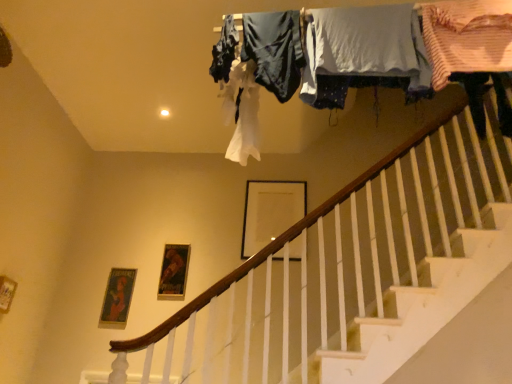
Consider the image. Measure the distance between striped cotton shirt at upper right, which is the 1th clothing in right-to-left order, and camera.

striped cotton shirt at upper right, which is the 1th clothing in right-to-left order, and camera are 5.51 feet apart.

You are a GUI agent. You are given a task and a screenshot of the screen. Output one action in this format:
    pyautogui.click(x=<x>, y=<y>)
    Task: Click on the dark blue fabric at upper center, the 4th clothing viewed from the right
    
    Given the screenshot: What is the action you would take?
    pyautogui.click(x=224, y=51)

The width and height of the screenshot is (512, 384). Describe the element at coordinates (224, 51) in the screenshot. I see `dark blue fabric at upper center, the first clothing in the left-to-right sequence` at that location.

You are a GUI agent. You are given a task and a screenshot of the screen. Output one action in this format:
    pyautogui.click(x=<x>, y=<y>)
    Task: Click on the white cotton shirt at upper center, which appears as the third clothing when viewed from the left
    The width and height of the screenshot is (512, 384).
    Given the screenshot: What is the action you would take?
    pyautogui.click(x=364, y=53)

Locate an element on the screen. The height and width of the screenshot is (384, 512). matte white picture frame at center, positioned as the second picture frame in bottom-to-top order is located at coordinates (270, 212).

The height and width of the screenshot is (384, 512). What do you see at coordinates (270, 212) in the screenshot?
I see `matte white picture frame at center, positioned as the 1th picture frame in top-to-bottom order` at bounding box center [270, 212].

The image size is (512, 384). I want to click on metallic gold picture frame at center, placed as the 2th picture frame when sorted from right to left, so click(x=174, y=272).

Is the depth of white cotton shirt at upper center, the 2th clothing viewed from the right, greater than that of metallic gold picture frame at center, the first picture frame in the left-to-right sequence?

No.

Which object is thinner, white cotton shirt at upper center, the 2th clothing viewed from the right, or metallic gold picture frame at center, the 2th picture frame positioned from the top?

Thinner between the two is metallic gold picture frame at center, the 2th picture frame positioned from the top.

Could you measure the distance between white cotton shirt at upper center, the 2th clothing viewed from the right, and metallic gold picture frame at center, placed as the 2th picture frame when sorted from right to left?

white cotton shirt at upper center, the 2th clothing viewed from the right, and metallic gold picture frame at center, placed as the 2th picture frame when sorted from right to left, are 2.17 meters apart.

Where is `the 2nd clothing above when counting from the metallic gold picture frame at center, which is counted as the first picture frame, starting from the bottom (from the image's perspective)`? This screenshot has width=512, height=384. the 2nd clothing above when counting from the metallic gold picture frame at center, which is counted as the first picture frame, starting from the bottom (from the image's perspective) is located at coordinates (364, 53).

From the picture: Is silky blue fabric at upper center, arranged as the third clothing when viewed from the right, looking in the opposite direction of dark blue fabric at upper center, the 4th clothing viewed from the right?

No, silky blue fabric at upper center, arranged as the third clothing when viewed from the right,'s orientation is not away from dark blue fabric at upper center, the 4th clothing viewed from the right.

Which object is more forward, silky blue fabric at upper center, the second clothing in the left-to-right sequence, or dark blue fabric at upper center, the first clothing in the left-to-right sequence?

silky blue fabric at upper center, the second clothing in the left-to-right sequence, is more forward.

Considering the sizes of objects silky blue fabric at upper center, the second clothing in the left-to-right sequence, and dark blue fabric at upper center, the 4th clothing viewed from the right, in the image provided, who is shorter, silky blue fabric at upper center, the second clothing in the left-to-right sequence, or dark blue fabric at upper center, the 4th clothing viewed from the right,?

Standing shorter between the two is dark blue fabric at upper center, the 4th clothing viewed from the right.

Between point (253, 42) and point (230, 46), which one is positioned in front?

The point (253, 42) is more forward.

Considering the relative positions of striped cotton shirt at upper right, which is the 4th clothing from left to right, and white cotton shirt at upper center, which appears as the third clothing when viewed from the left, in the image provided, is striped cotton shirt at upper right, which is the 4th clothing from left to right, to the left or to the right of white cotton shirt at upper center, which appears as the third clothing when viewed from the left,?

From the image, it's evident that striped cotton shirt at upper right, which is the 4th clothing from left to right, is to the right of white cotton shirt at upper center, which appears as the third clothing when viewed from the left.

Is striped cotton shirt at upper right, which is the 4th clothing from left to right, far away from white cotton shirt at upper center, which appears as the third clothing when viewed from the left?

No, striped cotton shirt at upper right, which is the 4th clothing from left to right, is not far from white cotton shirt at upper center, which appears as the third clothing when viewed from the left.

Is striped cotton shirt at upper right, which is the 1th clothing in right-to-left order, oriented away from white cotton shirt at upper center, which appears as the third clothing when viewed from the left?

No, striped cotton shirt at upper right, which is the 1th clothing in right-to-left order, is not facing the opposite direction of white cotton shirt at upper center, which appears as the third clothing when viewed from the left.

The width and height of the screenshot is (512, 384). I want to click on the 1st clothing counting from the left of the striped cotton shirt at upper right, which is the 4th clothing from left to right, so [364, 53].

Considering the positions of objects matte white picture frame at center, the first picture frame positioned from the right, and white cotton shirt at upper center, which appears as the third clothing when viewed from the left, in the image provided, who is more to the left, matte white picture frame at center, the first picture frame positioned from the right, or white cotton shirt at upper center, which appears as the third clothing when viewed from the left,?

From the viewer's perspective, matte white picture frame at center, the first picture frame positioned from the right, appears more on the left side.

What's the angular difference between matte white picture frame at center, positioned as the second picture frame in bottom-to-top order, and white cotton shirt at upper center, the 2th clothing viewed from the right,'s facing directions?

There is a 0.534-degree angle between the facing directions of matte white picture frame at center, positioned as the second picture frame in bottom-to-top order, and white cotton shirt at upper center, the 2th clothing viewed from the right.

From the image's perspective, is matte white picture frame at center, positioned as the 1th picture frame in top-to-bottom order, positioned above or below white cotton shirt at upper center, which appears as the third clothing when viewed from the left?

matte white picture frame at center, positioned as the 1th picture frame in top-to-bottom order, is below white cotton shirt at upper center, which appears as the third clothing when viewed from the left.

From their relative heights in the image, would you say matte white picture frame at center, positioned as the 1th picture frame in top-to-bottom order, is taller or shorter than white cotton shirt at upper center, the 2th clothing viewed from the right?

In the image, matte white picture frame at center, positioned as the 1th picture frame in top-to-bottom order, appears to be taller than white cotton shirt at upper center, the 2th clothing viewed from the right.

Considering the points (429, 51) and (251, 222), which point is in front, point (429, 51) or point (251, 222)?

The point (429, 51) is closer to the camera.

Which of these two, striped cotton shirt at upper right, which is the 1th clothing in right-to-left order, or matte white picture frame at center, positioned as the second picture frame in bottom-to-top order, stands taller?

matte white picture frame at center, positioned as the second picture frame in bottom-to-top order.

At what (x,y) coordinates should I click in order to perform the action: click on clothing that is the 3rd object located above the matte white picture frame at center, positioned as the 1th picture frame in top-to-bottom order (from the image's perspective). Please return your answer as a coordinate pair (x, y). This screenshot has height=384, width=512. Looking at the image, I should click on (467, 37).

Would you consider striped cotton shirt at upper right, which is the 1th clothing in right-to-left order, to be distant from matte white picture frame at center, positioned as the second picture frame in bottom-to-top order?

Yes.

Considering the positions of objects silky blue fabric at upper center, arranged as the third clothing when viewed from the right, and metallic gold picture frame at center, the 2th picture frame positioned from the top, in the image provided, who is more to the left, silky blue fabric at upper center, arranged as the third clothing when viewed from the right, or metallic gold picture frame at center, the 2th picture frame positioned from the top,?

Positioned to the left is metallic gold picture frame at center, the 2th picture frame positioned from the top.

Can you confirm if silky blue fabric at upper center, the second clothing in the left-to-right sequence, is taller than metallic gold picture frame at center, the 2th picture frame positioned from the top?

Indeed, silky blue fabric at upper center, the second clothing in the left-to-right sequence, has a greater height compared to metallic gold picture frame at center, the 2th picture frame positioned from the top.

Considering the relative sizes of silky blue fabric at upper center, arranged as the third clothing when viewed from the right, and metallic gold picture frame at center, which is counted as the first picture frame, starting from the bottom, in the image provided, is silky blue fabric at upper center, arranged as the third clothing when viewed from the right, smaller than metallic gold picture frame at center, which is counted as the first picture frame, starting from the bottom,?

Actually, silky blue fabric at upper center, arranged as the third clothing when viewed from the right, might be larger than metallic gold picture frame at center, which is counted as the first picture frame, starting from the bottom.

From a real-world perspective, relative to metallic gold picture frame at center, placed as the 2th picture frame when sorted from right to left, is silky blue fabric at upper center, the second clothing in the left-to-right sequence, vertically above or below?

silky blue fabric at upper center, the second clothing in the left-to-right sequence, is above metallic gold picture frame at center, placed as the 2th picture frame when sorted from right to left.

Which is in front, point (226, 36) or point (433, 62)?

Positioned in front is point (433, 62).

Identify the location of clothing that is the 3rd object to the left of the striped cotton shirt at upper right, which is the 4th clothing from left to right, starting at the anchor. (224, 51).

Which of these two, dark blue fabric at upper center, the first clothing in the left-to-right sequence, or striped cotton shirt at upper right, which is the 1th clothing in right-to-left order, stands taller?

striped cotton shirt at upper right, which is the 1th clothing in right-to-left order, is taller.

From the image's perspective, which one is positioned lower, dark blue fabric at upper center, the 4th clothing viewed from the right, or striped cotton shirt at upper right, which is the 1th clothing in right-to-left order?

striped cotton shirt at upper right, which is the 1th clothing in right-to-left order.

Locate an element on the screen. This screenshot has height=384, width=512. the 2nd clothing located above the metallic gold picture frame at center, the 2th picture frame positioned from the top (from a real-world perspective) is located at coordinates (364, 53).

From a real-world perspective, starting from the dark blue fabric at upper center, the first clothing in the left-to-right sequence, which clothing is the 2nd one below it? Please provide its 2D coordinates.

[(274, 50)]

When comparing their distances from white cotton shirt at upper center, the 2th clothing viewed from the right, does silky blue fabric at upper center, arranged as the third clothing when viewed from the right, or metallic gold picture frame at center, which is counted as the first picture frame, starting from the bottom, seem further?

The object further to white cotton shirt at upper center, the 2th clothing viewed from the right, is metallic gold picture frame at center, which is counted as the first picture frame, starting from the bottom.

When comparing their distances from white cotton shirt at upper center, which appears as the third clothing when viewed from the left, does metallic gold picture frame at center, the first picture frame in the left-to-right sequence, or matte white picture frame at center, positioned as the second picture frame in bottom-to-top order, seem further?

Based on the image, metallic gold picture frame at center, the first picture frame in the left-to-right sequence, appears to be further to white cotton shirt at upper center, which appears as the third clothing when viewed from the left.

Estimate the real-world distances between objects in this image. Which object is closer to white cotton shirt at upper center, the 2th clothing viewed from the right, metallic gold picture frame at center, placed as the 2th picture frame when sorted from right to left, or dark blue fabric at upper center, the first clothing in the left-to-right sequence?

Based on the image, dark blue fabric at upper center, the first clothing in the left-to-right sequence, appears to be nearer to white cotton shirt at upper center, the 2th clothing viewed from the right.

From the image, which object appears to be nearer to metallic gold picture frame at center, the 2th picture frame positioned from the top, white cotton shirt at upper center, which appears as the third clothing when viewed from the left, or dark blue fabric at upper center, the 4th clothing viewed from the right?

Among the two, dark blue fabric at upper center, the 4th clothing viewed from the right, is located nearer to metallic gold picture frame at center, the 2th picture frame positioned from the top.

Which object lies nearer to the anchor point dark blue fabric at upper center, the first clothing in the left-to-right sequence, metallic gold picture frame at center, the first picture frame in the left-to-right sequence, or matte white picture frame at center, positioned as the second picture frame in bottom-to-top order?

matte white picture frame at center, positioned as the second picture frame in bottom-to-top order, is positioned closer to the anchor dark blue fabric at upper center, the first clothing in the left-to-right sequence.

In the scene shown: When comparing their distances from matte white picture frame at center, positioned as the 1th picture frame in top-to-bottom order, does silky blue fabric at upper center, the second clothing in the left-to-right sequence, or dark blue fabric at upper center, the first clothing in the left-to-right sequence, seem further?

Among the two, dark blue fabric at upper center, the first clothing in the left-to-right sequence, is located further to matte white picture frame at center, positioned as the 1th picture frame in top-to-bottom order.

Looking at the image, which one is located closer to matte white picture frame at center, positioned as the second picture frame in bottom-to-top order, white cotton shirt at upper center, the 2th clothing viewed from the right, or metallic gold picture frame at center, the 2th picture frame positioned from the top?

The object closer to matte white picture frame at center, positioned as the second picture frame in bottom-to-top order, is metallic gold picture frame at center, the 2th picture frame positioned from the top.

Estimate the real-world distances between objects in this image. Which object is further from silky blue fabric at upper center, arranged as the third clothing when viewed from the right, metallic gold picture frame at center, the first picture frame in the left-to-right sequence, or dark blue fabric at upper center, the first clothing in the left-to-right sequence?

metallic gold picture frame at center, the first picture frame in the left-to-right sequence, is further to silky blue fabric at upper center, arranged as the third clothing when viewed from the right.

The image size is (512, 384). In order to click on picture frame between striped cotton shirt at upper right, which is the 1th clothing in right-to-left order, and matte white picture frame at center, positioned as the 1th picture frame in top-to-bottom order, in the front-back direction in this screenshot , I will do `click(174, 272)`.

Find the location of a particular element. Image resolution: width=512 pixels, height=384 pixels. picture frame between white cotton shirt at upper center, the 2th clothing viewed from the right, and matte white picture frame at center, positioned as the 1th picture frame in top-to-bottom order, from front to back is located at coordinates (174, 272).

Where is `clothing located between silky blue fabric at upper center, arranged as the third clothing when viewed from the right, and striped cotton shirt at upper right, which is the 1th clothing in right-to-left order, in the left-right direction`? clothing located between silky blue fabric at upper center, arranged as the third clothing when viewed from the right, and striped cotton shirt at upper right, which is the 1th clothing in right-to-left order, in the left-right direction is located at coordinates (364, 53).

The image size is (512, 384). Find the location of `clothing located between silky blue fabric at upper center, the second clothing in the left-to-right sequence, and metallic gold picture frame at center, the first picture frame in the left-to-right sequence, in the depth direction`. clothing located between silky blue fabric at upper center, the second clothing in the left-to-right sequence, and metallic gold picture frame at center, the first picture frame in the left-to-right sequence, in the depth direction is located at coordinates (224, 51).